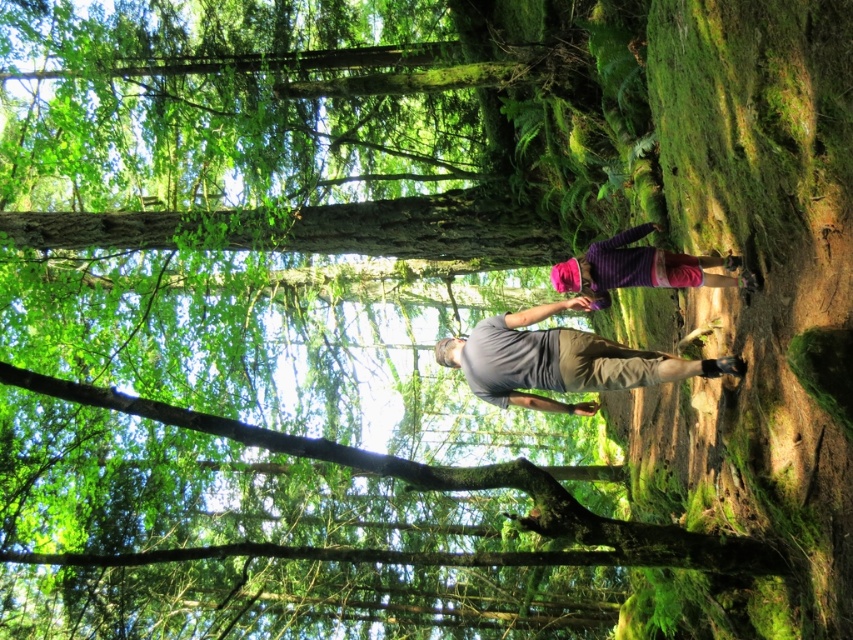
Question: Which object is closer to the camera taking this photo?

Choices:
 (A) purple striped shirt at center
 (B) smooth brown tree trunk at center

Answer: (A)

Question: Is smooth brown tree trunk at center in front of purple striped shirt at center?

Choices:
 (A) no
 (B) yes

Answer: (A)

Question: Which object appears closest to the camera in this image?

Choices:
 (A) purple striped shirt at center
 (B) gray cotton shirt at center
 (C) smooth brown tree trunk at center

Answer: (A)

Question: Can you confirm if gray cotton shirt at center is positioned above purple striped shirt at center?

Choices:
 (A) yes
 (B) no

Answer: (B)

Question: Considering the relative positions of gray cotton shirt at center and purple striped shirt at center in the image provided, where is gray cotton shirt at center located with respect to purple striped shirt at center?

Choices:
 (A) left
 (B) right

Answer: (A)

Question: Which is farther from the gray cotton shirt at center?

Choices:
 (A) purple striped shirt at center
 (B) smooth brown tree trunk at center

Answer: (B)